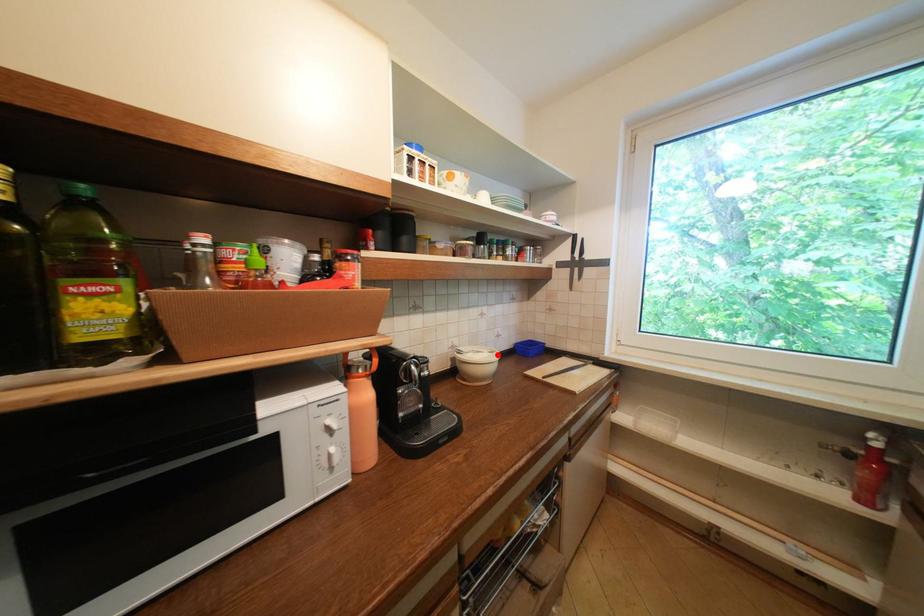
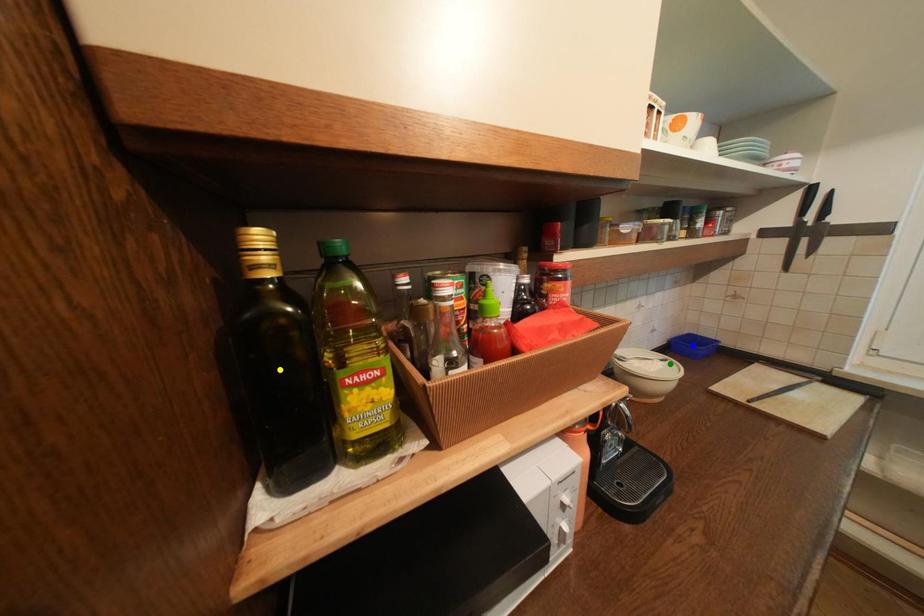
Question: I am providing you with two images of the same scene from different viewpoints. A red point is marked on the first image. You are given multiple points on the second image. Which spot in image 2 lines up with the point in image 1?

Choices:
 (A) yellow point
 (B) green point
 (C) blue point

Answer: (B)